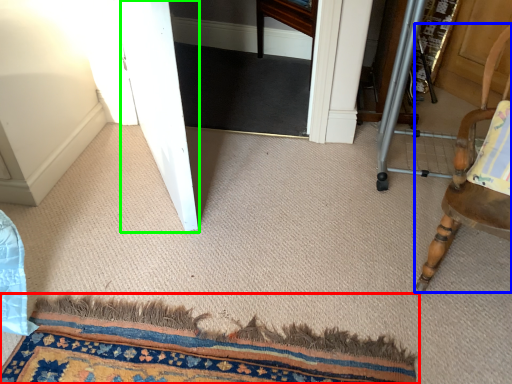
Question: Which is nearer to the mat (highlighted by a red box)? chair (highlighted by a blue box) or screen door (highlighted by a green box).

Choices:
 (A) chair
 (B) screen door

Answer: (A)